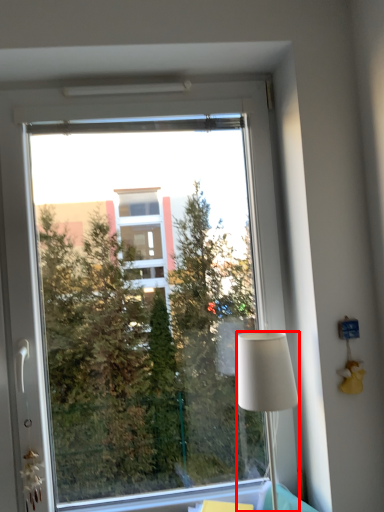
Question: From the image's perspective, what is the correct spatial positioning of lamp (annotated by the red box) in reference to window?

Choices:
 (A) below
 (B) above

Answer: (A)